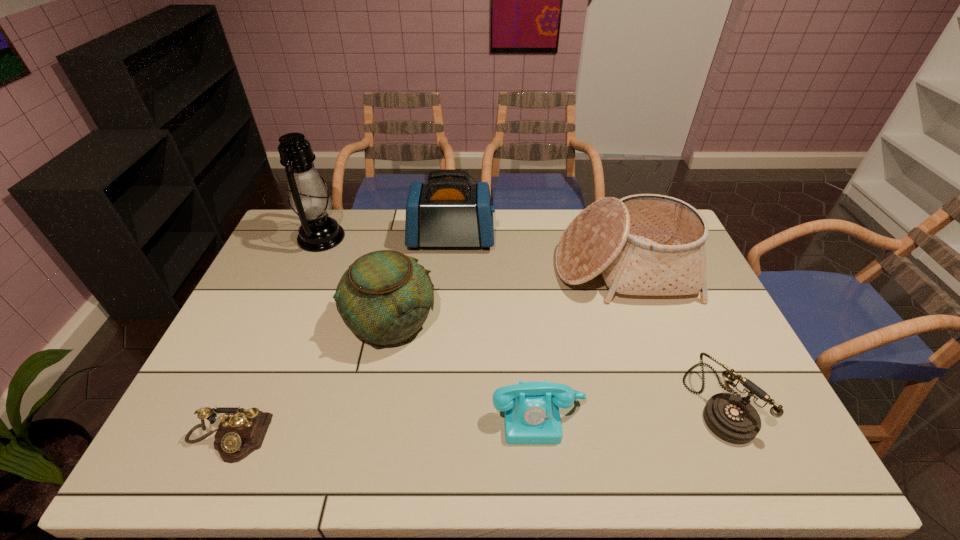
Identify the location of free space between the tallest object and the leftmost telephone. This screenshot has width=960, height=540. (275, 338).

Identify the location of free spot between the leftmost telephone and the toaster. (340, 338).

Find the location of a particular element. free space between the leftmost telephone and the rightmost telephone is located at coordinates (473, 420).

This screenshot has height=540, width=960. Identify the location of vacant area that lies between the rightmost telephone and the toaster. (585, 320).

The image size is (960, 540). Find the location of `free space between the rightmost telephone and the pottery`. free space between the rightmost telephone and the pottery is located at coordinates pyautogui.click(x=555, y=362).

Where is `free space between the leftmost telephone and the basket`? free space between the leftmost telephone and the basket is located at coordinates (425, 354).

What are the coordinates of `vacant area between the leftmost telephone and the second telephone from right to left` in the screenshot? It's located at (383, 426).

Locate an element on the screen. This screenshot has width=960, height=540. vacant area that lies between the fourth shortest object and the basket is located at coordinates (507, 296).

Locate an element on the screen. The height and width of the screenshot is (540, 960). the third closest object to the fourth tallest object is located at coordinates (242, 431).

This screenshot has width=960, height=540. I want to click on object that ranks as the fourth closest to the pottery, so click(x=309, y=199).